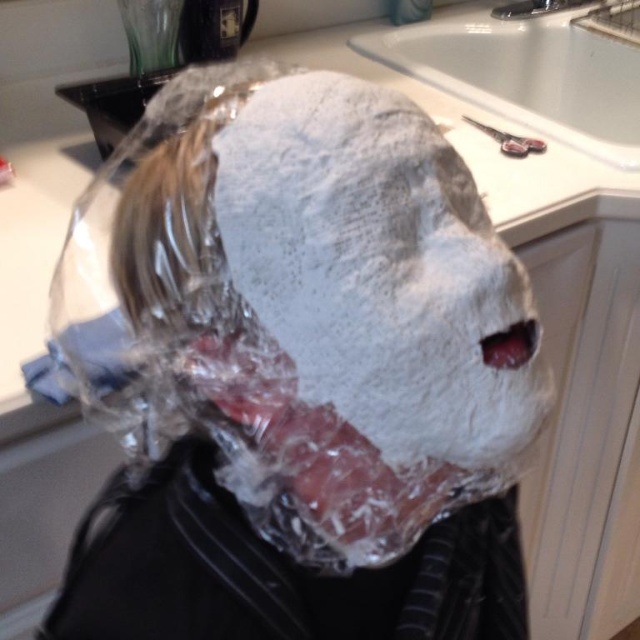
You are a bathroom designer assessing the layout. You need to ensure that the white powder mask at center can fit under the white ceramic sink at upper center. Based on their sizes, is this possible?

The white powder mask at center is not as tall as the white ceramic sink at upper center, so it can fit under the sink.

You are a photographer trying to capture the person in the bathroom. The white powder mask at center is represented by point (380, 269). Where should you position your camera to ensure the mask is centered in your shot?

To center the white powder mask at center, position your camera so that the point (380, 269) is at the center of your frame.

You are a sculptor who needs to place the white powder mask at center onto the white ceramic sink at upper center. Based on the scene, will the mask fit on the sink without overhanging the edges?

The white powder mask at center has a smaller size compared to white ceramic sink at upper center, so it will fit without overhanging the edges.